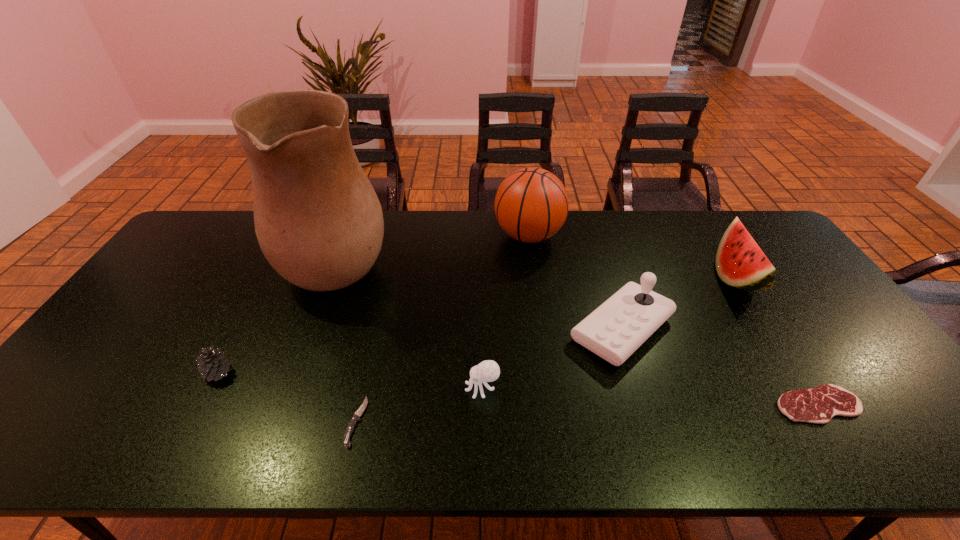
Where is `object that is the sixth nearest to the seventh shortest object`? The height and width of the screenshot is (540, 960). object that is the sixth nearest to the seventh shortest object is located at coordinates (819, 405).

Identify the location of vacant region that satisfies the following two spatial constraints: 1. on the front side of the steak; 2. on the right side of the pinecone. This screenshot has width=960, height=540. click(x=201, y=405).

You are a GUI agent. You are given a task and a screenshot of the screen. Output one action in this format:
    pyautogui.click(x=<x>, y=<y>)
    Task: Click on the vacant space that satisfies the following two spatial constraints: 1. on the front-facing side of the octopus; 2. on the front side of the pocketknife
    The image size is (960, 540).
    Given the screenshot: What is the action you would take?
    pyautogui.click(x=482, y=422)

Where is `vacant point that satisfies the following two spatial constraints: 1. on the front-facing side of the steak; 2. on the left side of the fifth object from right to left`? This screenshot has width=960, height=540. vacant point that satisfies the following two spatial constraints: 1. on the front-facing side of the steak; 2. on the left side of the fifth object from right to left is located at coordinates (482, 405).

You are a GUI agent. You are given a task and a screenshot of the screen. Output one action in this format:
    pyautogui.click(x=<x>, y=<y>)
    Task: Click on the vacant space that satisfies the following two spatial constraints: 1. on the outer rind of the watermelon; 2. on the front side of the pinecone
    Image resolution: width=960 pixels, height=540 pixels.
    Given the screenshot: What is the action you would take?
    pyautogui.click(x=795, y=373)